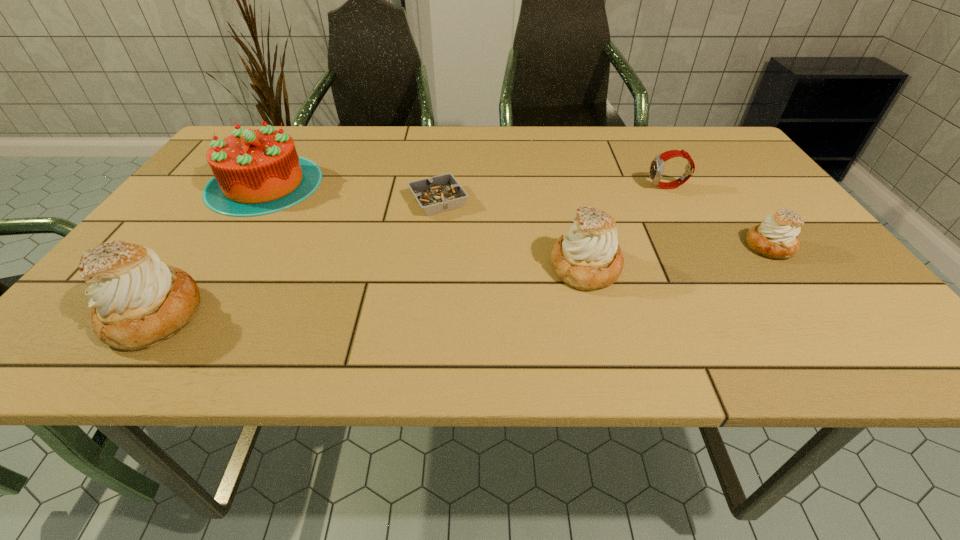
At what (x,y) coordinates should I click in order to perform the action: click on spot to insert another pastry for uniform distribution. Please return your answer as a coordinate pair (x, y). This screenshot has width=960, height=540. Looking at the image, I should click on (381, 290).